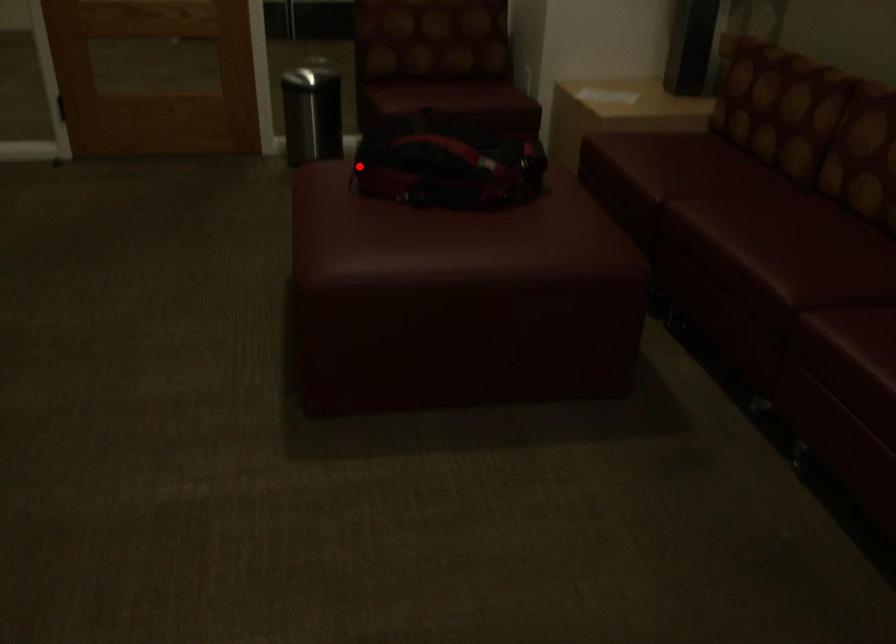
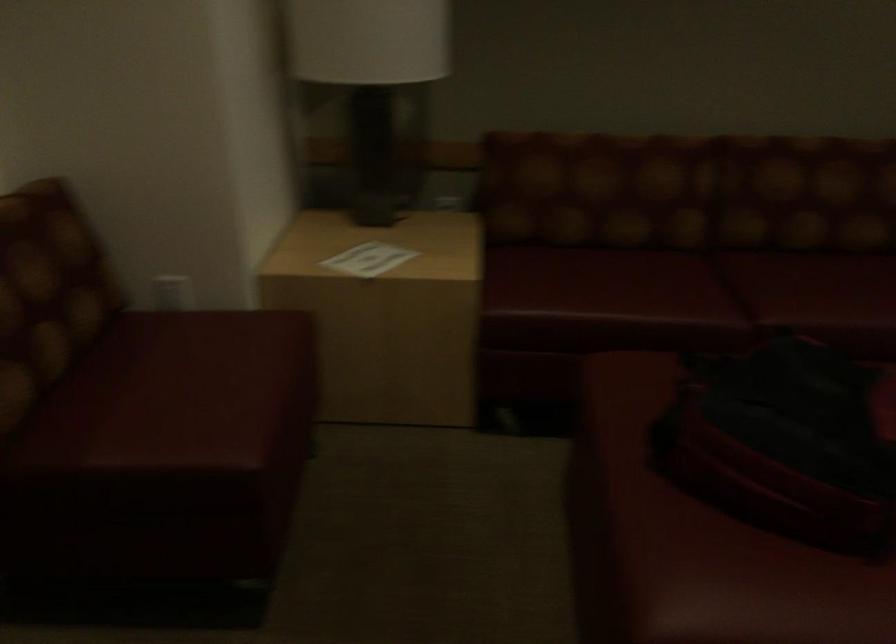
Question: I am providing you with two images of the same scene from different viewpoints. Given a red point in image1, look at the same physical point in image2. Is it:

Choices:
 (A) Closer to the viewpoint
 (B) Farther from the viewpoint

Answer: (A)